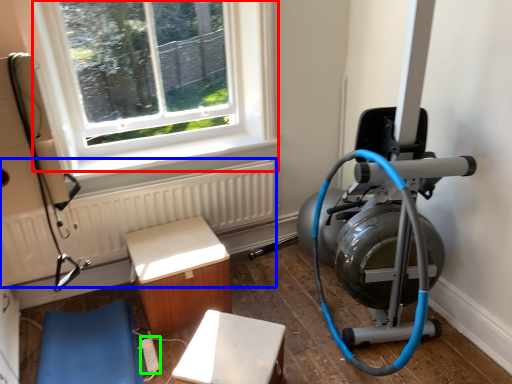
Question: Estimate the real-world distances between objects in this image. Which object is farther from window (highlighted by a red box), radiator (highlighted by a blue box) or extension cord (highlighted by a green box)?

Choices:
 (A) radiator
 (B) extension cord

Answer: (B)